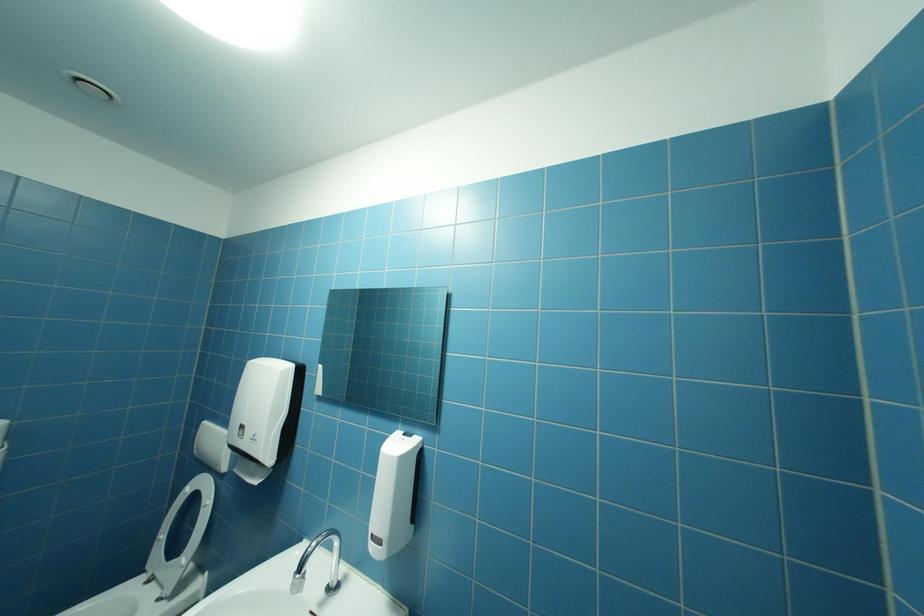
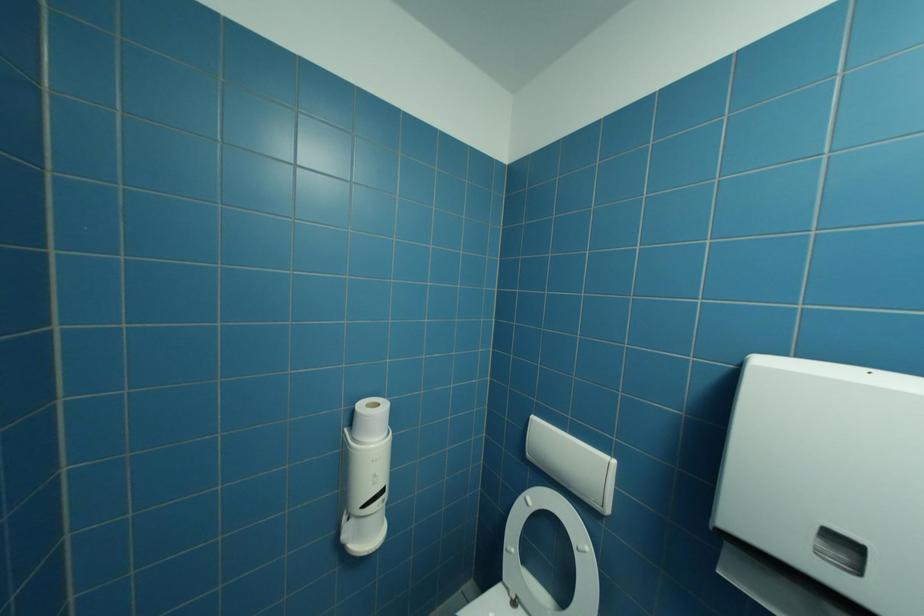
In a continuous first-person perspective shot, in which direction is the camera moving?

The movement direction of the cameraman is left, forward.